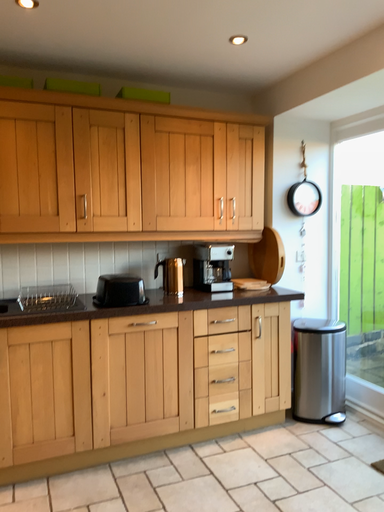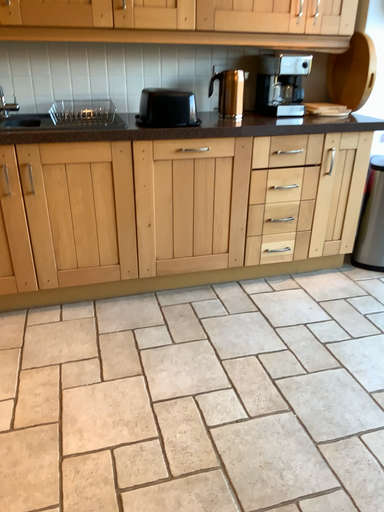
Question: Which way did the camera rotate in the video?

Choices:
 (A) rotated upward
 (B) rotated downward

Answer: (B)